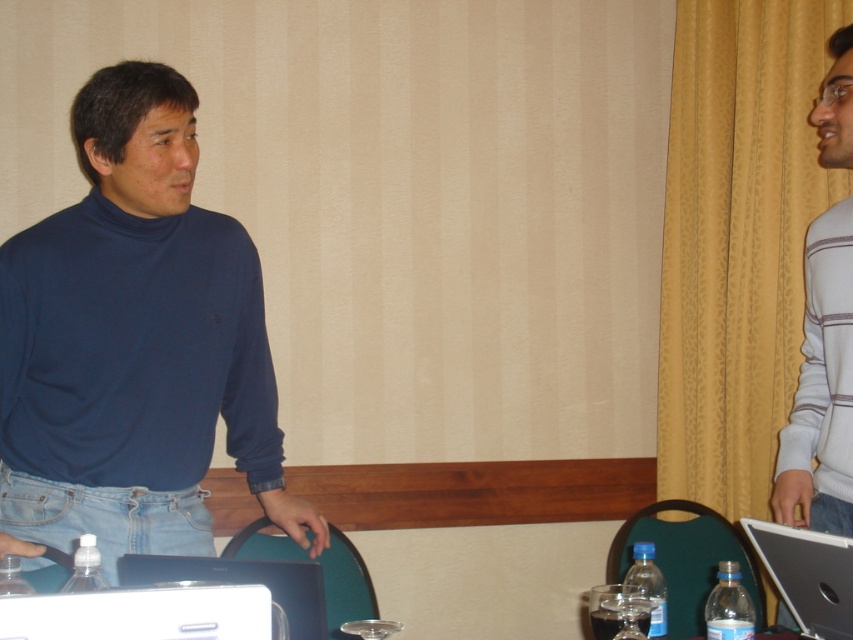
You are organizing a small event and need to place a decorative item on the table. The gray striped sweater at right and the white plastic laptop at lower left are already there. Which object can you place a small vase next to without moving them, considering their sizes?

The gray striped sweater at right has a larger size compared to the white plastic laptop at lower left, so placing the small vase next to the white plastic laptop at lower left would be more feasible as there is more space available there.

You are standing in a conference room and see the two people. The person on the left is wearing a dark blue turtleneck sweater and light blue jeans. The person on the right is in a light gray long sleeve shirt. There is a laptop, a glass of water, and a bottle of water on the table. If you want to touch the matte blue turtleneck sweater at left, where should you move to? Please answer with coordinates in the format of point in the image like point (x=134, y=342).

The point corresponding to the matte blue turtleneck sweater at left is point (x=134, y=342).

You are organizing a photoshoot and need to place a 1.2 meter wide backdrop between the matte blue turtleneck sweater at left and the gray striped sweater at right. Based on their widths, will the backdrop fit comfortably between them?

The matte blue turtleneck sweater at left might be wider than gray striped sweater at right, so the 1.2 meter wide backdrop may not fit comfortably between them if the combined width of both sweaters exceeds the backdrop width. However, without exact measurements, it is uncertain.